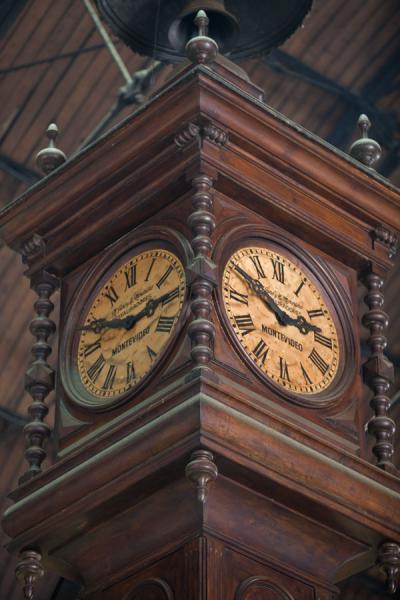
Where is `ceiling`? This screenshot has height=600, width=400. ceiling is located at coordinates (72, 103), (352, 48), (15, 336).